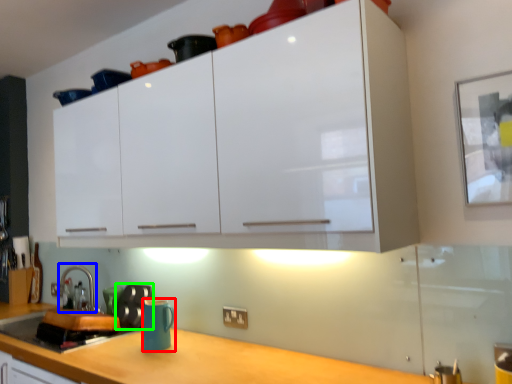
Question: Considering the real-world distances, which object is closest to mug (highlighted by a red box)? faucet (highlighted by a blue box) or appliance (highlighted by a green box).

Choices:
 (A) faucet
 (B) appliance

Answer: (B)